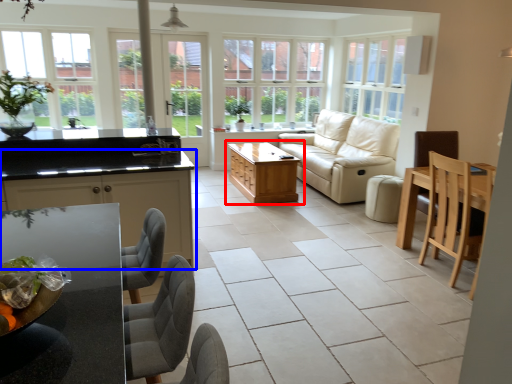
Question: Which point is closer to the camera, table (highlighted by a red box) or cabinetry (highlighted by a blue box)?

Choices:
 (A) table
 (B) cabinetry

Answer: (B)